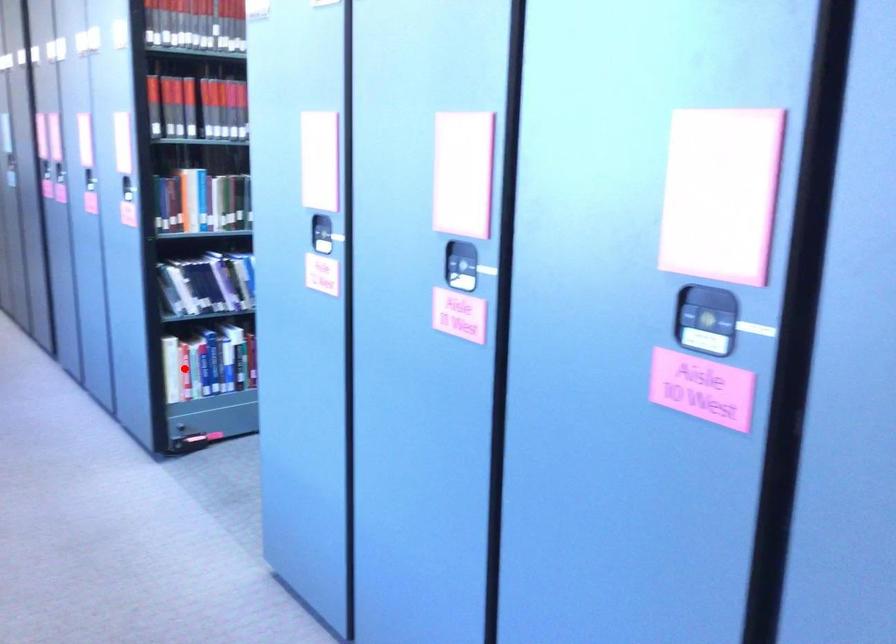
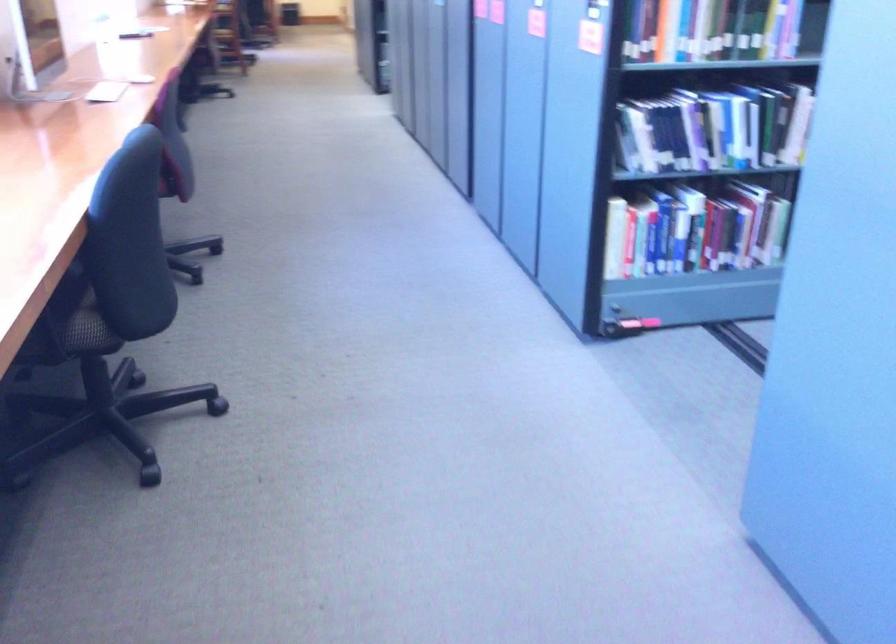
Question: I am providing you with two images of the same scene from different viewpoints. Given a red point in image1, look at the same physical point in image2. Is it:

Choices:
 (A) Closer to the viewpoint
 (B) Farther from the viewpoint

Answer: (A)